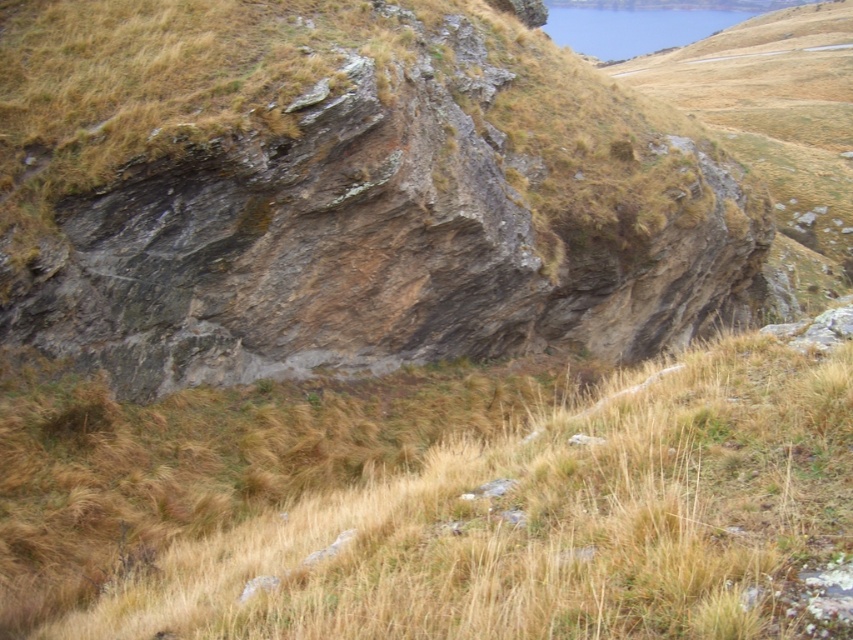
Is rusty rock formation at center shorter than dry grass at center?

No.

Who is shorter, rusty rock formation at center or dry grass at center?

dry grass at center

Is point (407, 76) positioned after point (781, 538)?

Yes, point (407, 76) is behind point (781, 538).

This screenshot has width=853, height=640. I want to click on rusty rock formation at center, so click(341, 193).